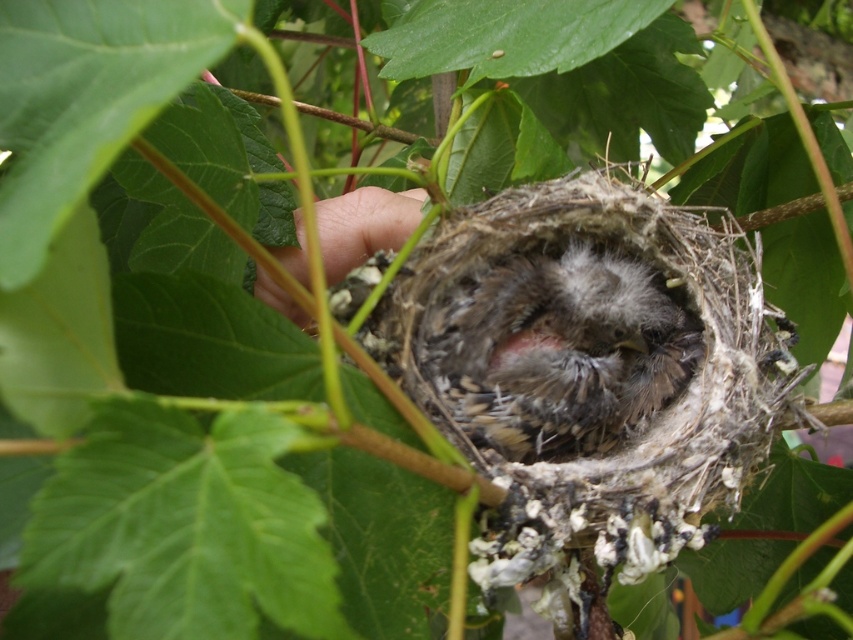
You are a wildlife photographer trying to capture the baby birds in the nest. You notice a point marked at coordinates (555, 349). What feature is located at this point?

The point at coordinates (555, 349) marks soft brown feathers at center.

You are a wildlife photographer trying to capture a closeup of the baby birds in the nest. You need to determine which feature is larger to focus your lens properly. Which is bigger between the soft brown feathers at center and the fuzzy skin at center?

The soft brown feathers at center is bigger than the fuzzy skin at center, so you should focus your lens on the soft brown feathers at center.